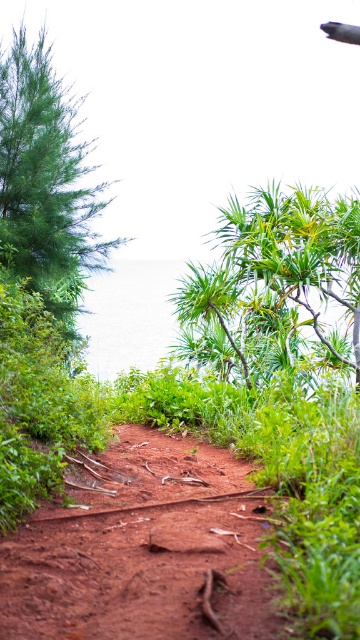
You are a hiker carrying a heavy backpack and need to decide whether to walk along the dusty red dirt track at center or go around the green matte tree at left to reach the ocean. Given that the path along the track is 10.46 meters longer than going around the tree, which path would require less energy?

Going around the green matte tree at left would require less energy since the path along the dusty red dirt track at center is 10.46 meters longer than the alternative route.

You are a hiker trying to navigate through the dirt path. You see the dusty red dirt track at center and the green leafy plant at center. Which object is located to the right of the other?

The dusty red dirt track at center is positioned on the left side of green leafy plant at center, so the green leafy plant at center is to the right of the dusty red dirt track at center.